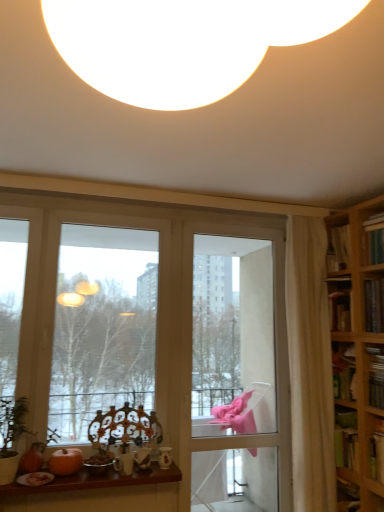
Question: From the image's perspective, is hardcover book at upper right, the first book in the top-to-bottom sequence, beneath transparent glass window at center?

Choices:
 (A) no
 (B) yes

Answer: (A)

Question: Can you confirm if hardcover book at upper right, acting as the third book starting from the bottom, is smaller than transparent glass window at center?

Choices:
 (A) no
 (B) yes

Answer: (B)

Question: Is hardcover book at upper right, acting as the third book starting from the bottom, looking in the opposite direction of transparent glass window at center?

Choices:
 (A) no
 (B) yes

Answer: (A)

Question: Is hardcover book at upper right, acting as the third book starting from the bottom, outside of transparent glass window at center?

Choices:
 (A) no
 (B) yes

Answer: (B)

Question: Does hardcover book at upper right, the first book in the top-to-bottom sequence, have a greater height compared to transparent glass window at center?

Choices:
 (A) yes
 (B) no

Answer: (B)

Question: In terms of height, does wooden table at lower center look taller or shorter compared to white sheer curtain at right?

Choices:
 (A) short
 (B) tall

Answer: (A)

Question: From the image's perspective, is wooden table at lower center positioned above or below white sheer curtain at right?

Choices:
 (A) below
 (B) above

Answer: (A)

Question: In terms of width, does wooden table at lower center look wider or thinner when compared to white sheer curtain at right?

Choices:
 (A) thin
 (B) wide

Answer: (B)

Question: Is wooden table at lower center in front of or behind white sheer curtain at right in the image?

Choices:
 (A) front
 (B) behind

Answer: (A)

Question: From the image's perspective, is hardcover book at upper right, acting as the third book starting from the bottom, located above or below transparent glass window at center?

Choices:
 (A) below
 (B) above

Answer: (B)

Question: Which is correct: hardcover book at upper right, the first book in the top-to-bottom sequence, is inside transparent glass window at center, or outside of it?

Choices:
 (A) inside
 (B) outside

Answer: (B)

Question: Looking at the image, does hardcover book at upper right, acting as the third book starting from the bottom, seem bigger or smaller compared to transparent glass window at center?

Choices:
 (A) big
 (B) small

Answer: (B)

Question: Is hardcover book at upper right, acting as the third book starting from the bottom, to the left or to the right of transparent glass window at center in the image?

Choices:
 (A) left
 (B) right

Answer: (B)

Question: Visually, is hardcover book at right, the 1th book when ordered from bottom to top, positioned to the left or to the right of transparent glass window at center?

Choices:
 (A) right
 (B) left

Answer: (A)

Question: Considering the positions of point (380, 385) and point (190, 287), is point (380, 385) closer or farther from the camera than point (190, 287)?

Choices:
 (A) farther
 (B) closer

Answer: (B)